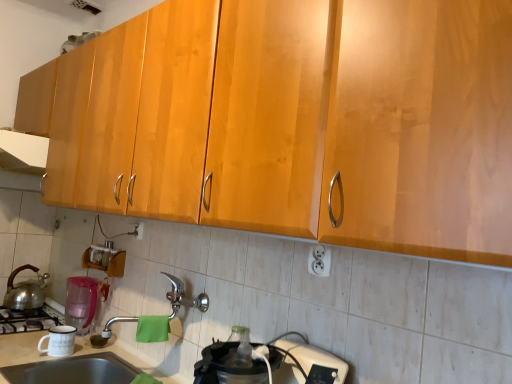
The width and height of the screenshot is (512, 384). Find the location of `white ceramic mug at lower left, which is counted as the first appliance, starting from the front`. white ceramic mug at lower left, which is counted as the first appliance, starting from the front is located at coordinates (59, 341).

This screenshot has width=512, height=384. What do you see at coordinates (80, 303) in the screenshot?
I see `pink plastic pitcher at lower left, the second appliance positioned from the front` at bounding box center [80, 303].

Measure the distance between shiny metallic tea pot at left and camera.

shiny metallic tea pot at left is 7.26 feet from camera.

You are a GUI agent. You are given a task and a screenshot of the screen. Output one action in this format:
    pyautogui.click(x=<x>, y=<y>)
    Task: Click on the white plastic electric outlet at center, the 1th electric outlet positioned from the back
    The width and height of the screenshot is (512, 384).
    Given the screenshot: What is the action you would take?
    pyautogui.click(x=137, y=231)

Is white plastic electric outlet at center, placed as the second electric outlet when sorted from front to back, oriented away from white ceramic mug at lower left, placed as the 2th appliance when sorted from back to front?

No, white plastic electric outlet at center, placed as the second electric outlet when sorted from front to back, is not facing away from white ceramic mug at lower left, placed as the 2th appliance when sorted from back to front.

From a real-world perspective, is white plastic electric outlet at center, placed as the second electric outlet when sorted from front to back, located beneath white ceramic mug at lower left, placed as the 2th appliance when sorted from back to front?

No, from a real-world perspective, white plastic electric outlet at center, placed as the second electric outlet when sorted from front to back, is not under white ceramic mug at lower left, placed as the 2th appliance when sorted from back to front.

Is point (135, 232) behind point (60, 353)?

Yes.

From the image's perspective, is white plastic electric outlet at center, placed as the second electric outlet when sorted from front to back, above white ceramic mug at lower left, placed as the 2th appliance when sorted from back to front?

Indeed, from the image's perspective, white plastic electric outlet at center, placed as the second electric outlet when sorted from front to back, is shown above white ceramic mug at lower left, placed as the 2th appliance when sorted from back to front.

Does white glossy exhaust hood at upper left have a larger size compared to white plastic electric outlet at center, marked as the 2th electric outlet in a right-to-left arrangement?

Yes, white glossy exhaust hood at upper left is bigger than white plastic electric outlet at center, marked as the 2th electric outlet in a right-to-left arrangement.

Which object is more forward, white glossy exhaust hood at upper left or white plastic electric outlet at center, placed as the second electric outlet when sorted from front to back?

white glossy exhaust hood at upper left is closer to the camera.

Does white glossy exhaust hood at upper left have a lesser height compared to white plastic electric outlet at center, arranged as the 1th electric outlet when viewed from the left?

No.

Is white glossy exhaust hood at upper left thinner than white plastic electric outlet at center, the 1th electric outlet positioned from the back?

In fact, white glossy exhaust hood at upper left might be wider than white plastic electric outlet at center, the 1th electric outlet positioned from the back.

Is point (30, 155) positioned before point (63, 337)?

No, (30, 155) is further to viewer.

Is white glossy exhaust hood at upper left looking in the opposite direction of white ceramic mug at lower left, which is counted as the first appliance, starting from the front?

white glossy exhaust hood at upper left does not have its back to white ceramic mug at lower left, which is counted as the first appliance, starting from the front.

From a real-world perspective, is white glossy exhaust hood at upper left below white ceramic mug at lower left, placed as the 2th appliance when sorted from back to front?

Actually, white glossy exhaust hood at upper left is physically above white ceramic mug at lower left, placed as the 2th appliance when sorted from back to front, in the real world.

From the image's perspective, does white glossy exhaust hood at upper left appear lower than white ceramic mug at lower left, which is counted as the first appliance, starting from the front?

No.

Can you confirm if pink plastic pitcher at lower left, the second appliance positioned from the front, is thinner than white plastic outlet at lower center, acting as the 2th electric outlet starting from the left?

Incorrect, the width of pink plastic pitcher at lower left, the second appliance positioned from the front, is not less than that of white plastic outlet at lower center, acting as the 2th electric outlet starting from the left.

From the picture: Is pink plastic pitcher at lower left, the second appliance positioned from the front, oriented towards white plastic outlet at lower center, acting as the first electric outlet starting from the front?

No, pink plastic pitcher at lower left, the second appliance positioned from the front, is not facing towards white plastic outlet at lower center, acting as the first electric outlet starting from the front.

I want to click on appliance that is the 2nd one when counting leftward from the white plastic outlet at lower center, acting as the 2th electric outlet starting from the left, so click(80, 303).

From the picture: From the image's perspective, is pink plastic pitcher at lower left, the second appliance positioned from the front, located above or below white plastic outlet at lower center, acting as the 1th electric outlet starting from the right?

Clearly, from the image's perspective, pink plastic pitcher at lower left, the second appliance positioned from the front, is below white plastic outlet at lower center, acting as the 1th electric outlet starting from the right.

Is matte stainless steel sink at lower left positioned behind pink plastic pitcher at lower left, acting as the 1th appliance starting from the back?

No, it is not.

Between matte stainless steel sink at lower left and pink plastic pitcher at lower left, acting as the 1th appliance starting from the back, which one has more height?

pink plastic pitcher at lower left, acting as the 1th appliance starting from the back, is taller.

From a real-world perspective, is matte stainless steel sink at lower left over pink plastic pitcher at lower left, acting as the 1th appliance starting from the back?

No, from a real-world perspective, matte stainless steel sink at lower left is not on top of pink plastic pitcher at lower left, acting as the 1th appliance starting from the back.

From a real-world perspective, is shiny metallic tea pot at left above or below silver metallic faucet at center?

In terms of real-world spatial position, shiny metallic tea pot at left is below silver metallic faucet at center.

Consider the image. Is shiny metallic tea pot at left situated inside silver metallic faucet at center or outside?

shiny metallic tea pot at left is not enclosed by silver metallic faucet at center.

Is shiny metallic tea pot at left placed right next to silver metallic faucet at center?

No, shiny metallic tea pot at left is not beside silver metallic faucet at center.

Based on the photo, is shiny metallic tea pot at left further to the viewer compared to silver metallic faucet at center?

Yes.

From the image's perspective, which is above, pink plastic pitcher at lower left, acting as the 1th appliance starting from the back, or matte stainless steel sink at lower left?

pink plastic pitcher at lower left, acting as the 1th appliance starting from the back, is shown above in the image.

From a real-world perspective, which is physically below, pink plastic pitcher at lower left, acting as the 1th appliance starting from the back, or matte stainless steel sink at lower left?

From a 3D spatial view, matte stainless steel sink at lower left is below.

Is point (81, 283) closer or farther from the camera than point (73, 382)?

Point (81, 283).

Is pink plastic pitcher at lower left, the second appliance positioned from the front, outside of matte stainless steel sink at lower left?

Yes, pink plastic pitcher at lower left, the second appliance positioned from the front, is located beyond the bounds of matte stainless steel sink at lower left.

The height and width of the screenshot is (384, 512). What are the coordinates of `electric outlet lying behind the white ceramic mug at lower left, which is counted as the first appliance, starting from the front` in the screenshot? It's located at (137, 231).

Locate an element on the screen. Image resolution: width=512 pixels, height=384 pixels. exhaust hood lying above the white plastic electric outlet at center, placed as the second electric outlet when sorted from front to back (from the image's perspective) is located at coordinates (23, 152).

Considering their positions, is white glossy exhaust hood at upper left positioned closer to white ceramic mug at lower left, which is counted as the first appliance, starting from the front, than silver metallic faucet at center?

Based on the image, silver metallic faucet at center appears to be nearer to white ceramic mug at lower left, which is counted as the first appliance, starting from the front.

Based on their spatial positions, is pink plastic pitcher at lower left, acting as the 1th appliance starting from the back, or white ceramic mug at lower left, which is counted as the first appliance, starting from the front, further from silver metallic faucet at center?

The object further to silver metallic faucet at center is white ceramic mug at lower left, which is counted as the first appliance, starting from the front.

Considering their positions, is shiny metallic tea pot at left positioned further to silver metallic faucet at center than pink plastic pitcher at lower left, acting as the 1th appliance starting from the back?

Based on the image, shiny metallic tea pot at left appears to be further to silver metallic faucet at center.

Based on their spatial positions, is white ceramic mug at lower left, which is counted as the first appliance, starting from the front, or silver metallic faucet at center further from matte stainless steel sink at lower left?

Among the two, silver metallic faucet at center is located further to matte stainless steel sink at lower left.

Which object lies further to the anchor point shiny metallic tea pot at left, white ceramic mug at lower left, which is counted as the first appliance, starting from the front, or white glossy exhaust hood at upper left?

Among the two, white glossy exhaust hood at upper left is located further to shiny metallic tea pot at left.

Based on their spatial positions, is white glossy exhaust hood at upper left or white plastic electric outlet at center, arranged as the 1th electric outlet when viewed from the left, further from shiny metallic tea pot at left?

white plastic electric outlet at center, arranged as the 1th electric outlet when viewed from the left, lies further to shiny metallic tea pot at left than the other object.

Which object lies nearer to the anchor point pink plastic pitcher at lower left, acting as the 1th appliance starting from the back, white plastic outlet at lower center, acting as the first electric outlet starting from the front, or matte stainless steel sink at lower left?

Based on the image, matte stainless steel sink at lower left appears to be nearer to pink plastic pitcher at lower left, acting as the 1th appliance starting from the back.

Looking at this image, when comparing their distances from matte stainless steel sink at lower left, does white plastic outlet at lower center, acting as the 1th electric outlet starting from the right, or white ceramic mug at lower left, placed as the 2th appliance when sorted from back to front, seem closer?

white ceramic mug at lower left, placed as the 2th appliance when sorted from back to front, is positioned closer to the anchor matte stainless steel sink at lower left.

Locate an element on the screen. electric outlet situated between white glossy exhaust hood at upper left and white plastic outlet at lower center, the second electric outlet from the back, from left to right is located at coordinates (137, 231).

This screenshot has width=512, height=384. In order to click on electric outlet between pink plastic pitcher at lower left, acting as the 1th appliance starting from the back, and white plastic outlet at lower center, the second electric outlet from the back, from left to right in this screenshot , I will do `click(137, 231)`.

The height and width of the screenshot is (384, 512). I want to click on faucet between white ceramic mug at lower left, placed as the 2th appliance when sorted from back to front, and white plastic outlet at lower center, acting as the 2th electric outlet starting from the left, from left to right, so click(183, 297).

Where is `faucet between matte stainless steel sink at lower left and shiny metallic tea pot at left from front to back`? The image size is (512, 384). faucet between matte stainless steel sink at lower left and shiny metallic tea pot at left from front to back is located at coordinates (183, 297).